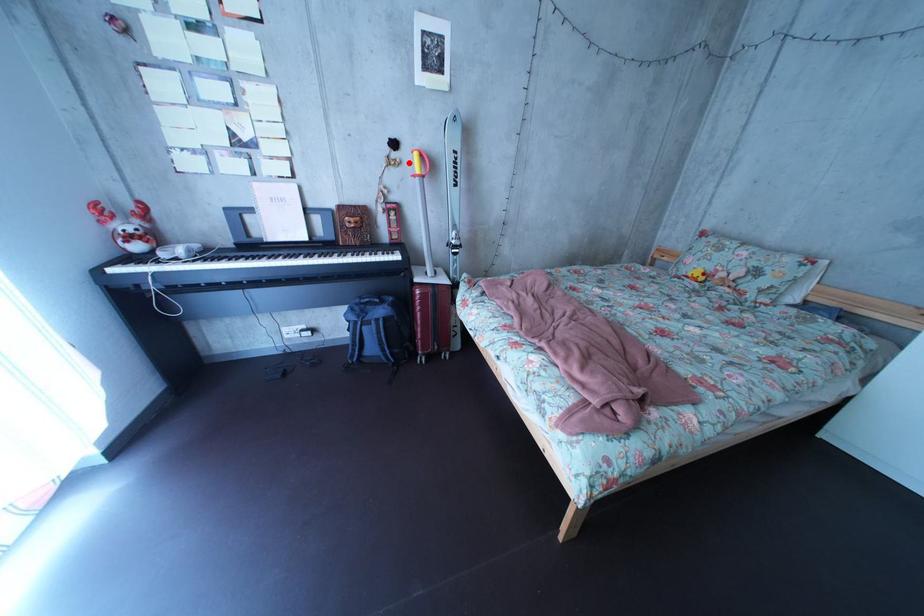
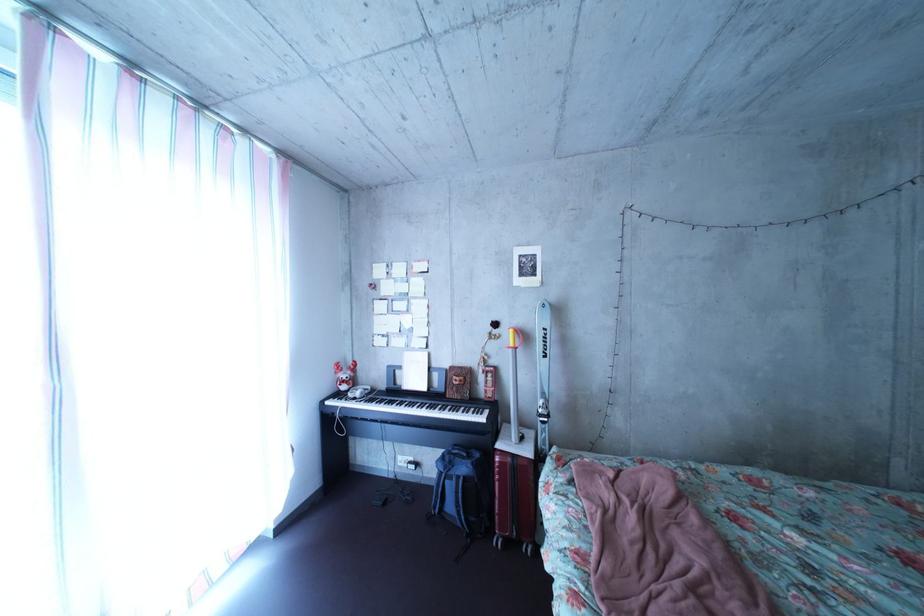
Find the pixel in the second image that matches the highlighted location in the first image.

(509, 339)